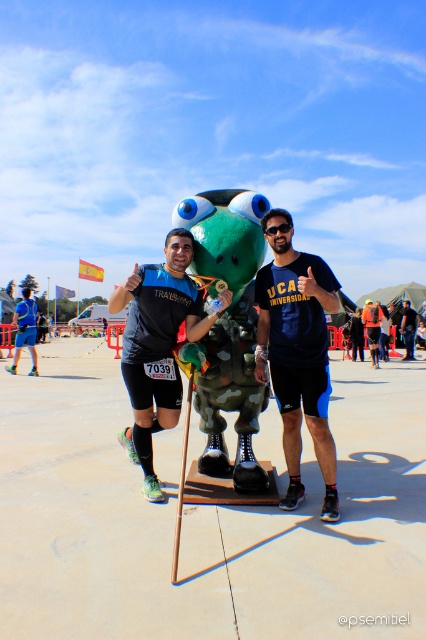
Question: Which object appears closest to the camera in this image?

Choices:
 (A) black matte shirt at center
 (B) blue matte shirt at center

Answer: (B)

Question: Among these points, which one is farthest from the camera?

Choices:
 (A) (167, 260)
 (B) (299, 260)

Answer: (A)

Question: Can you confirm if blue matte shirt at center is thinner than black matte shirt at center?

Choices:
 (A) yes
 (B) no

Answer: (A)

Question: Can you confirm if blue matte shirt at center is smaller than black matte shirt at center?

Choices:
 (A) no
 (B) yes

Answer: (B)

Question: Does blue matte shirt at center lie behind black matte shirt at center?

Choices:
 (A) no
 (B) yes

Answer: (A)